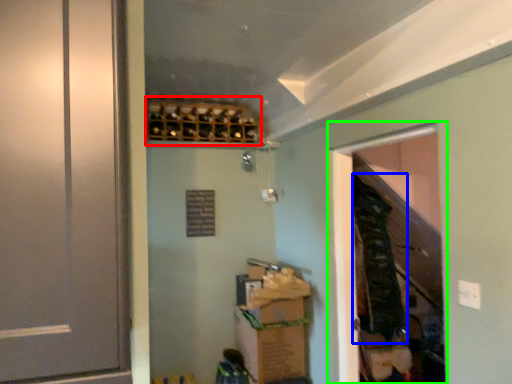
Question: Considering the real-world distances, which object is closest to wine rack (highlighted by a red box)? laundry (highlighted by a blue box) or screen door (highlighted by a green box).

Choices:
 (A) laundry
 (B) screen door

Answer: (B)